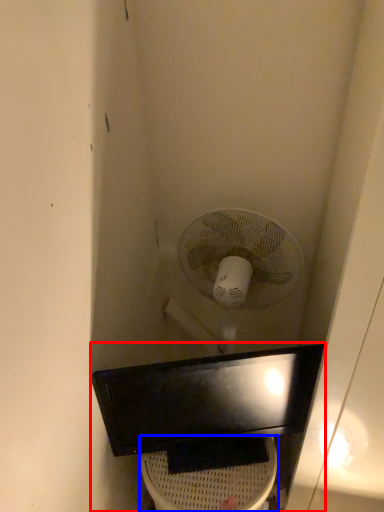
Question: Which point is closer to the camera, sink (highlighted by a red box) or toilet bowl (highlighted by a blue box)?

Choices:
 (A) sink
 (B) toilet bowl

Answer: (A)